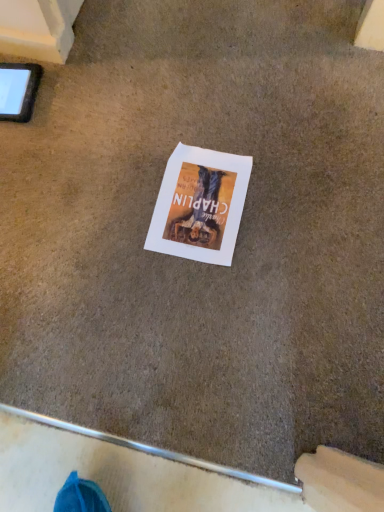
The width and height of the screenshot is (384, 512). I want to click on free space above black matte tablet at upper left (from a real-world perspective), so click(x=14, y=89).